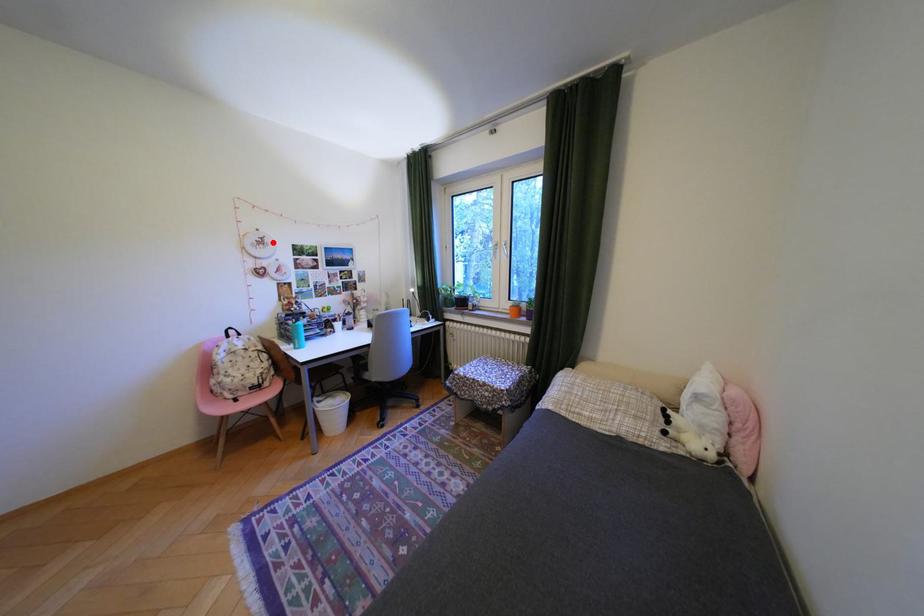
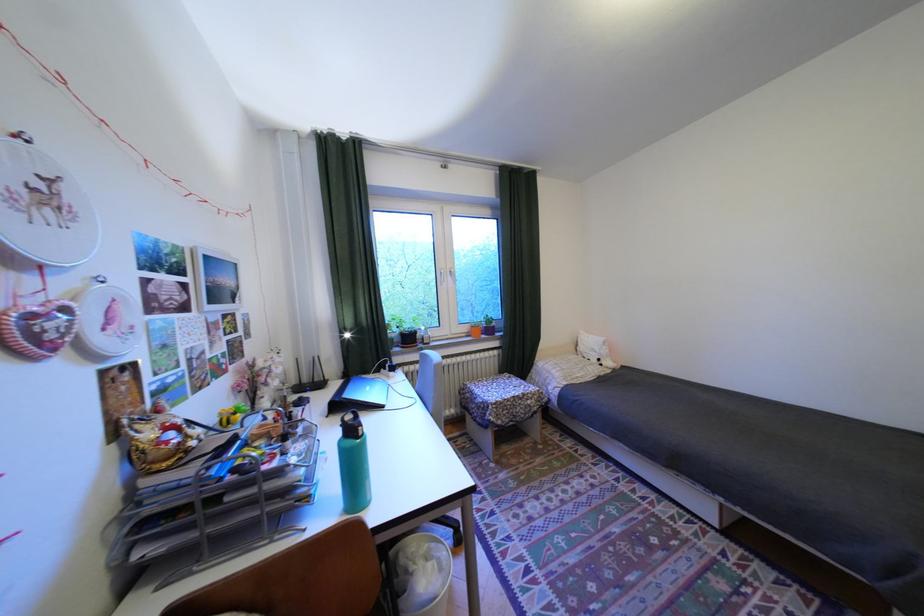
In the second image, find the point that corresponds to the highlighted location in the first image.

(58, 197)